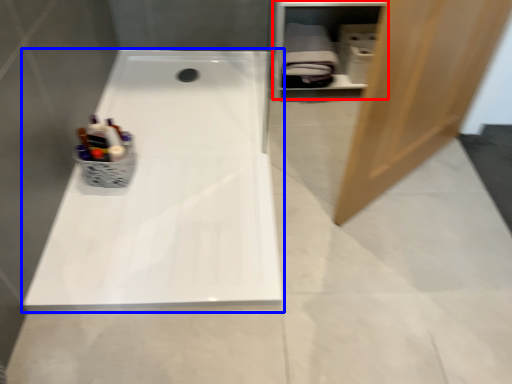
Question: Which object appears farthest to the camera in this image, shelf (highlighted by a red box) or bathtub (highlighted by a blue box)?

Choices:
 (A) shelf
 (B) bathtub

Answer: (A)